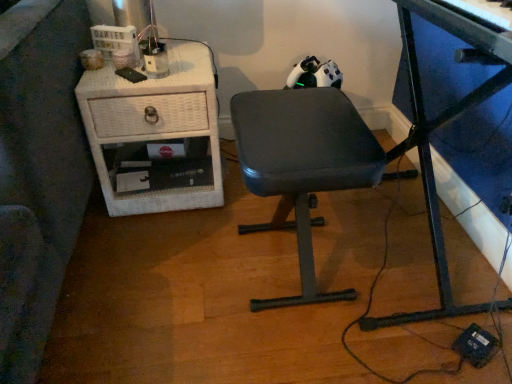
Locate an element on the screen. The width and height of the screenshot is (512, 384). free space that is to the left of dark gray fabric chair at center is located at coordinates (168, 278).